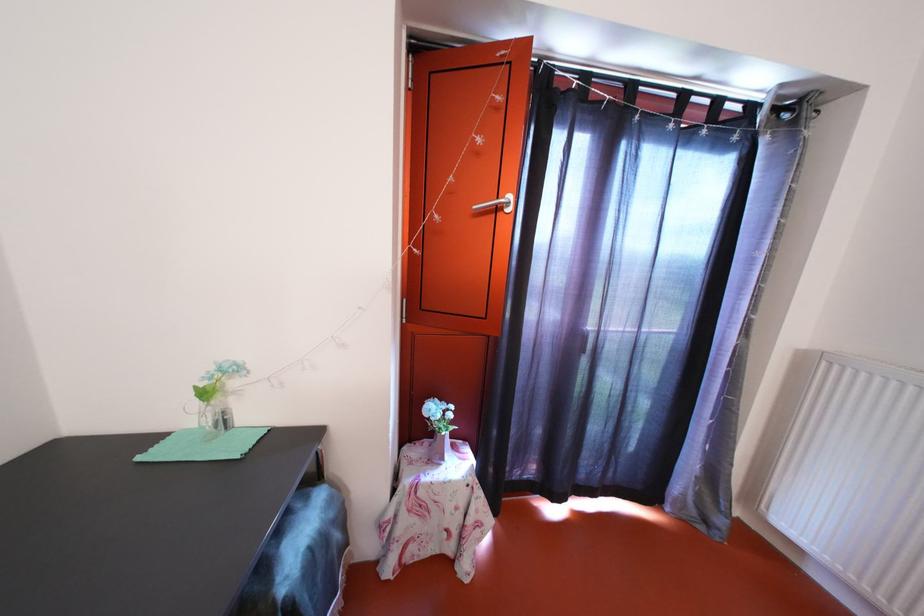
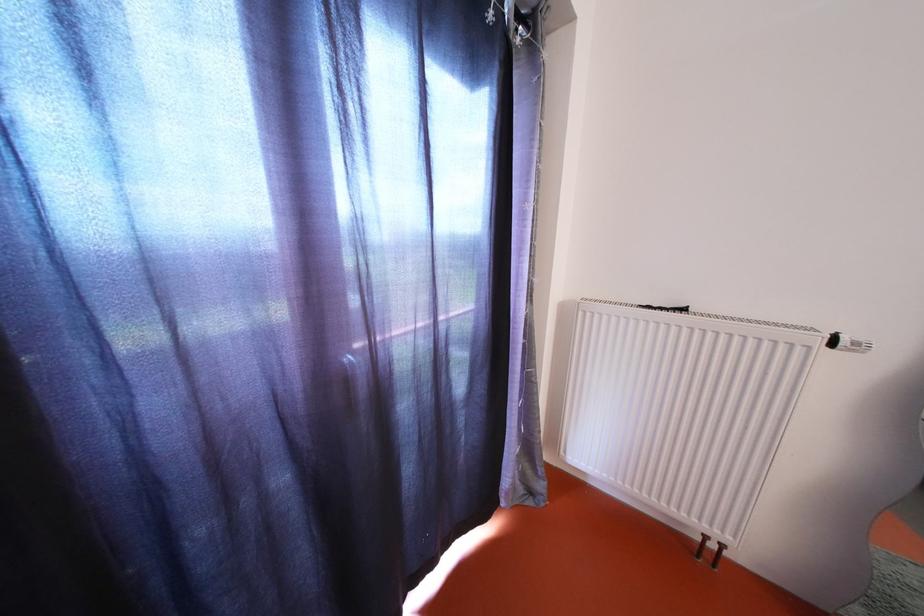
Question: The camera is either moving clockwise (left) or counter-clockwise (right) around the object. The first image is from the beginning of the video and the second image is from the end. Is the camera moving left or right when shooting the video?

Choices:
 (A) Left
 (B) Right

Answer: (A)